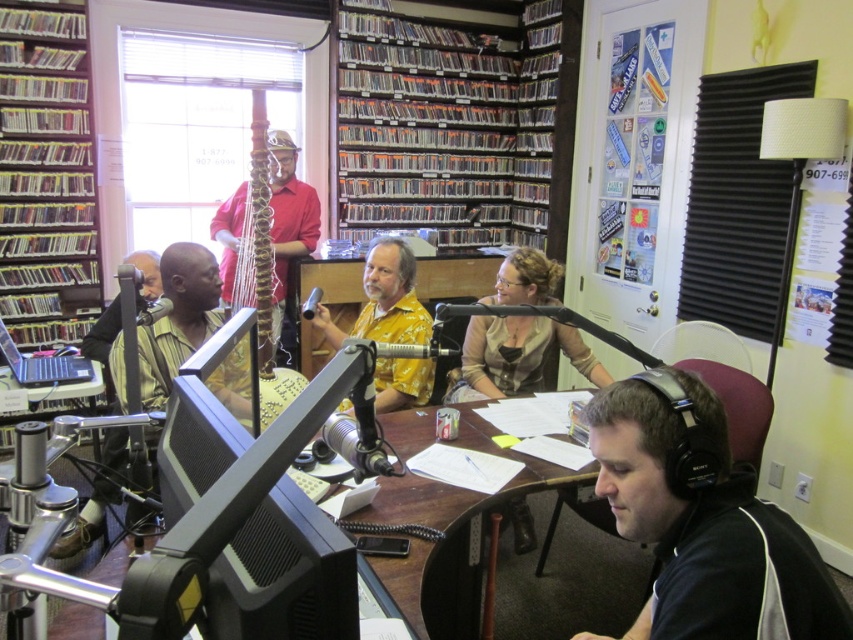
You are a guest speaker in the radio station studio and need to place your notes on the desk. The yellow printed shirt at center is currently in the way of the matte black laptop at left. Can you move the shirt to access the laptop?

The yellow printed shirt at center is positioned over the matte black laptop at left, so moving the shirt would allow access to the laptop.

You are a guest performer in the radio station studio and need to place your small music stand, which is 15 inches tall, next to the wooden harp at center. Can the music stand be placed without blocking the view of the metallic silver laptop at lower left?

The wooden harp at center is taller than the metallic silver laptop at lower left. Since the music stand is only 15 inches tall, it can be placed next to the harp without obstructing the view of the laptop as the laptop is shorter and positioned lower left.

You are a guest entering the radio studio and need to find a place to sit. The host is wearing the yellow printed shirt at center and there is a wooden harp at center in the room. Which object is shorter and thus easier to sit near without obstruction?

The yellow printed shirt at center is not as tall as the wooden harp at center, so it is shorter. Therefore, sitting near the yellow printed shirt at center would be easier as it poses less obstruction.